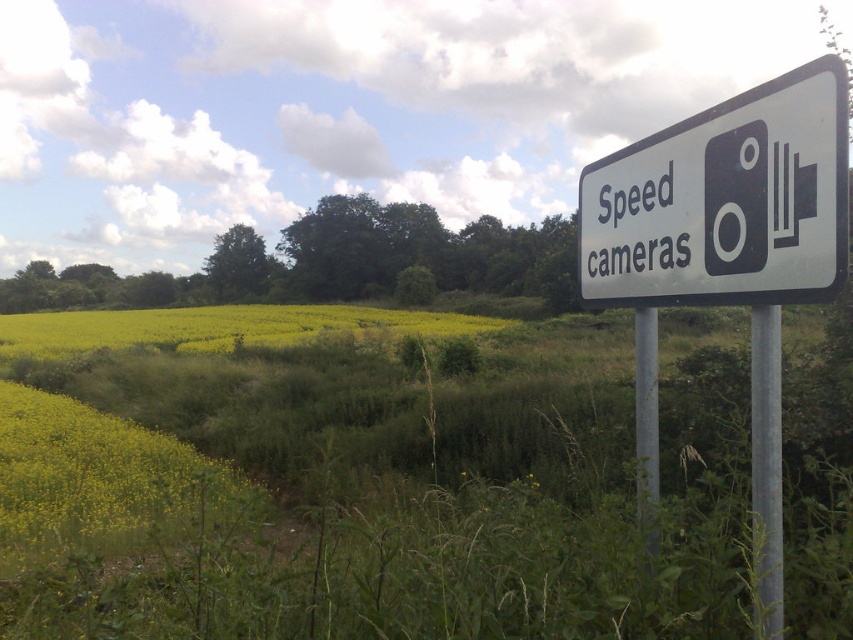
You are driving a car and see the white plastic sign at upper right and the silver metallic pole at right. Which object appears larger in your view?

The white plastic sign at upper right appears larger than the silver metallic pole at right because it is bigger in size.

You are driving a car and see the white plastic sign at upper right and the silver metallic pole at right. Which object is closer to you?

The white plastic sign at upper right is closer because it is in front of the silver metallic pole at right.